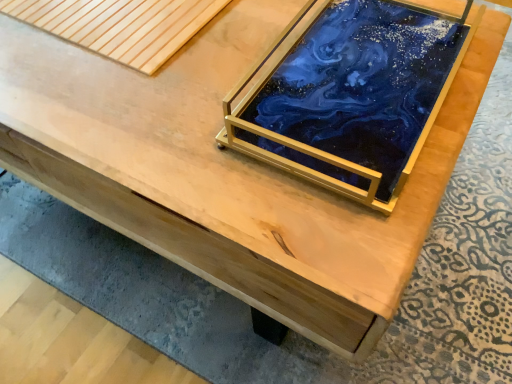
Identify the location of free location in front of natural wood plank at upper left. The width and height of the screenshot is (512, 384). (109, 106).